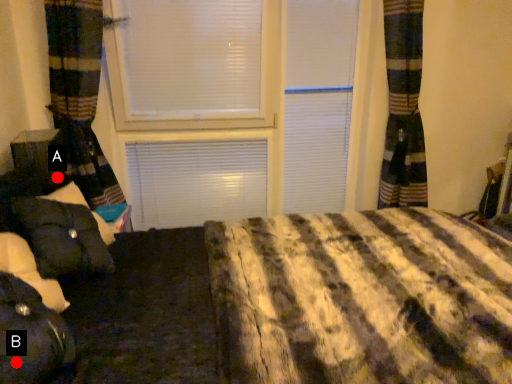
Question: Two points are circled on the image, labeled by A and B beside each circle. Which of the following is the farthest from the observer?

Choices:
 (A) A is further
 (B) B is further

Answer: (A)